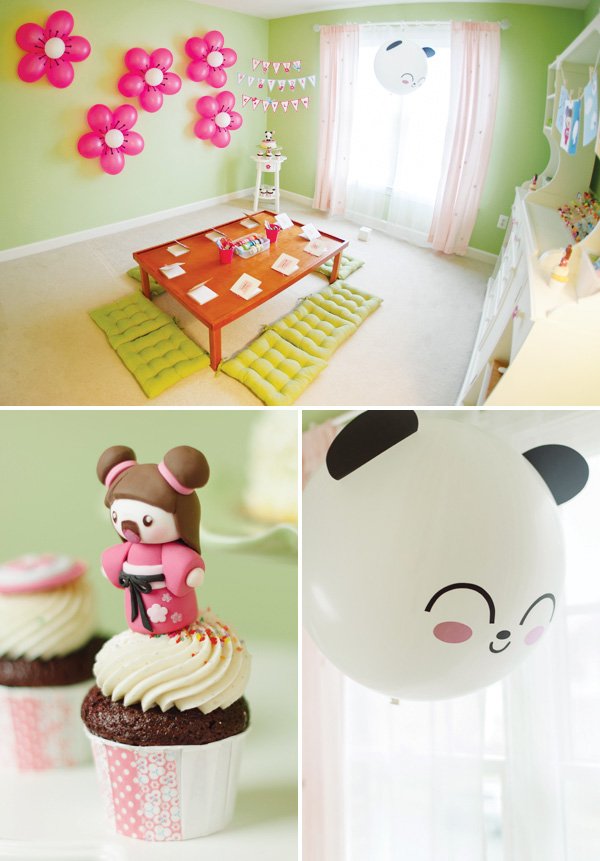
Find the location of `table`. table is located at coordinates (220, 273).